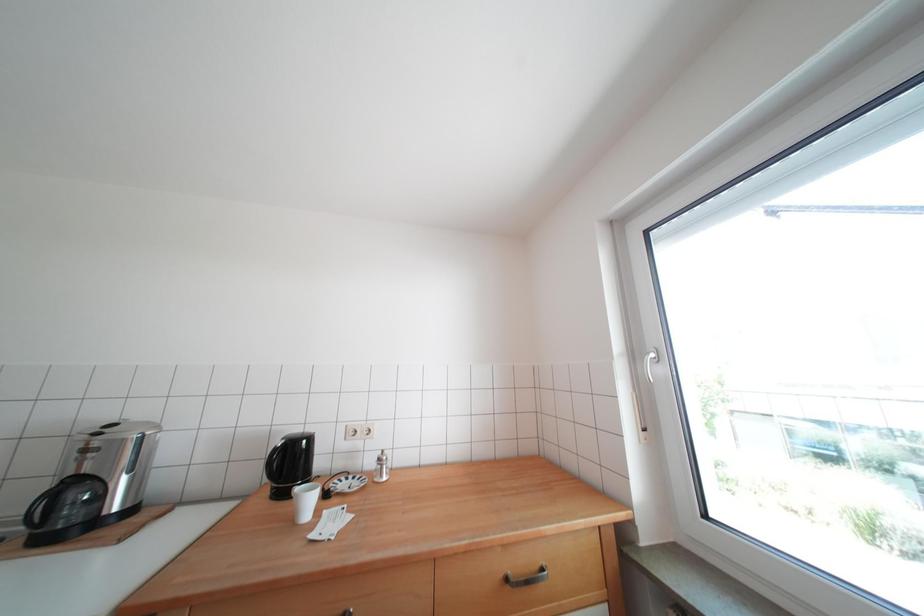
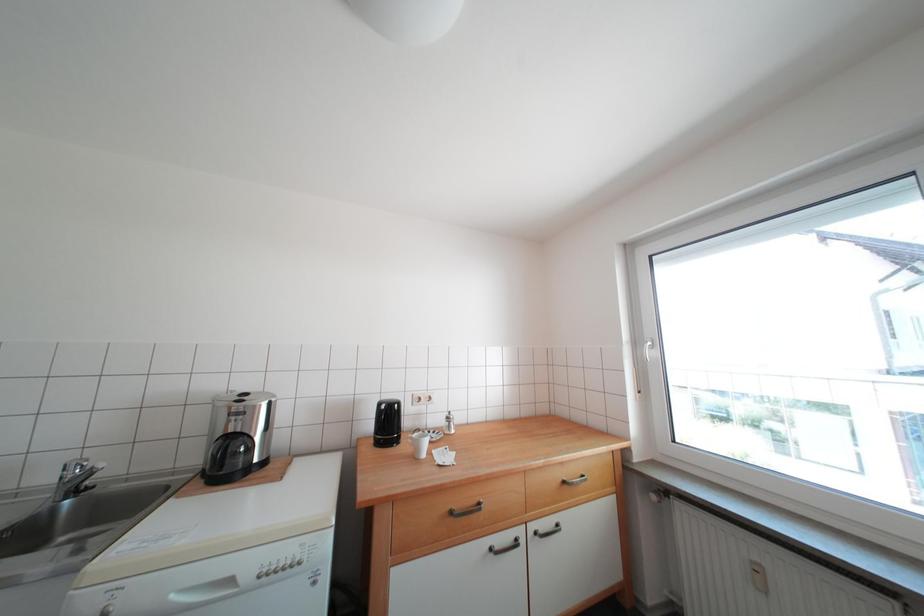
In a continuous first-person perspective shot, in which direction is the camera moving?

The cameraman walked toward left, backward.